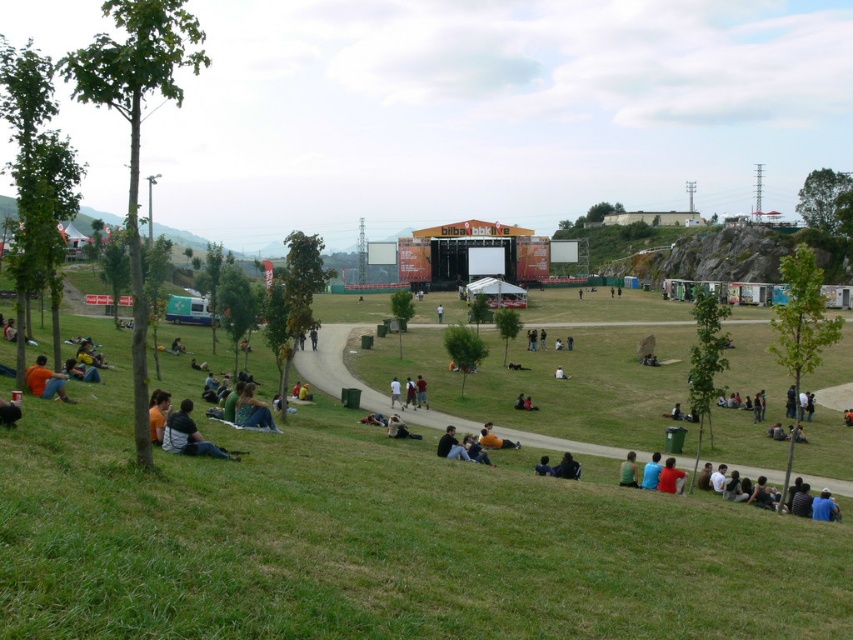
Which is more to the left, orange t-shirt at lower left or dark gray fabric jacket at lower center?

Positioned to the left is orange t-shirt at lower left.

Between orange t-shirt at lower left and dark gray fabric jacket at lower center, which one has less height?

With less height is dark gray fabric jacket at lower center.

Is point (62, 392) farther from camera compared to point (457, 449)?

No, it is not.

You are a GUI agent. You are given a task and a screenshot of the screen. Output one action in this format:
    pyautogui.click(x=<x>, y=<y>)
    Task: Click on the orange t-shirt at lower left
    The width and height of the screenshot is (853, 640).
    Given the screenshot: What is the action you would take?
    pyautogui.click(x=45, y=380)

Between dark blue jeans at lower center and dark blue jeans at center, which one has more height?

dark blue jeans at center is taller.

From the picture: Between dark blue jeans at lower center and dark blue jeans at center, which one has less height?

dark blue jeans at lower center

Image resolution: width=853 pixels, height=640 pixels. Describe the element at coordinates (567, 467) in the screenshot. I see `dark blue jeans at lower center` at that location.

Image resolution: width=853 pixels, height=640 pixels. What are the coordinates of `dark blue jeans at lower center` in the screenshot? It's located at (567, 467).

Can you confirm if green fabric jacket at lower left is shorter than dark blue jeans at lower center?

Incorrect, green fabric jacket at lower left's height does not fall short of dark blue jeans at lower center's.

Is green fabric jacket at lower left wider than dark blue jeans at lower center?

Correct, the width of green fabric jacket at lower left exceeds that of dark blue jeans at lower center.

Locate an element on the screen. green fabric jacket at lower left is located at coordinates (252, 410).